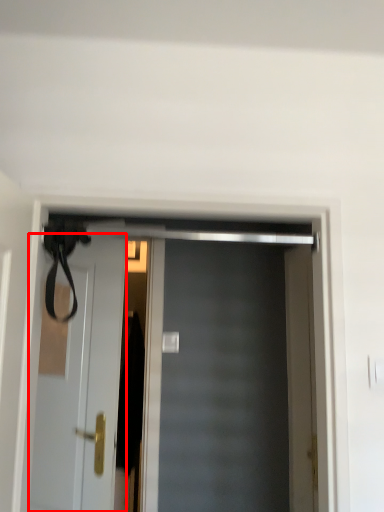
Question: In this image, where is door (annotated by the red box) located relative to door?

Choices:
 (A) left
 (B) right

Answer: (A)